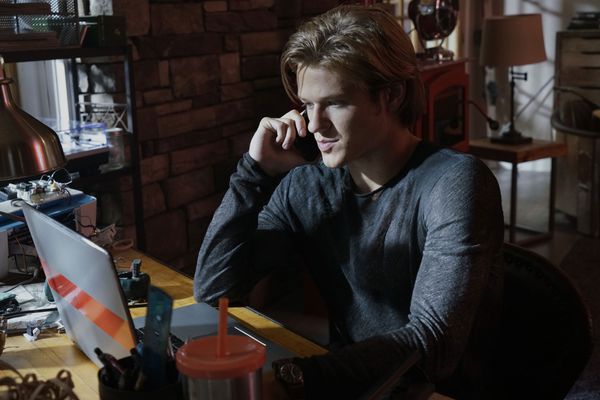
You are a GUI agent. You are given a task and a screenshot of the screen. Output one action in this format:
    pyautogui.click(x=<x>, y=<y>)
    Task: Click on the pen holder
    This screenshot has width=600, height=400.
    Given the screenshot: What is the action you would take?
    pyautogui.click(x=158, y=383)